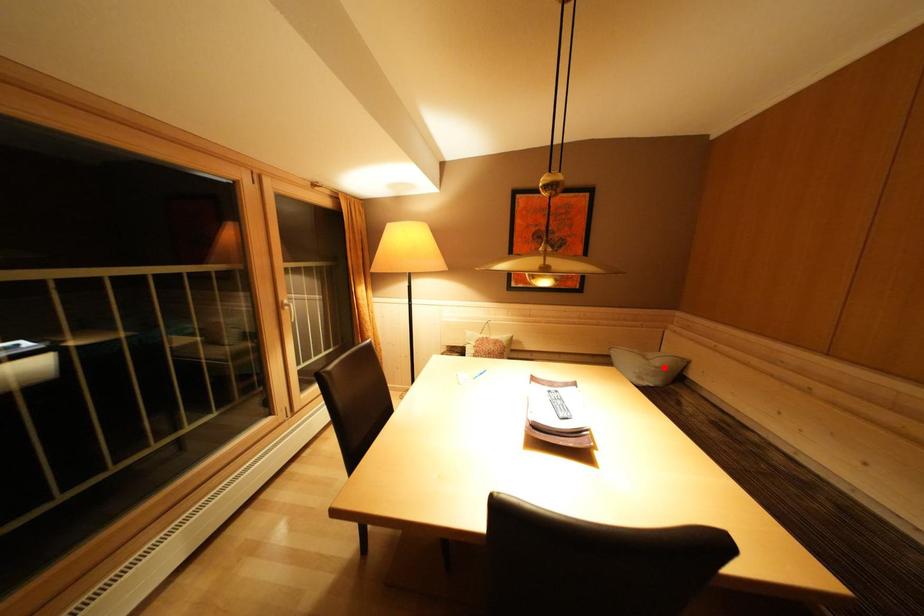
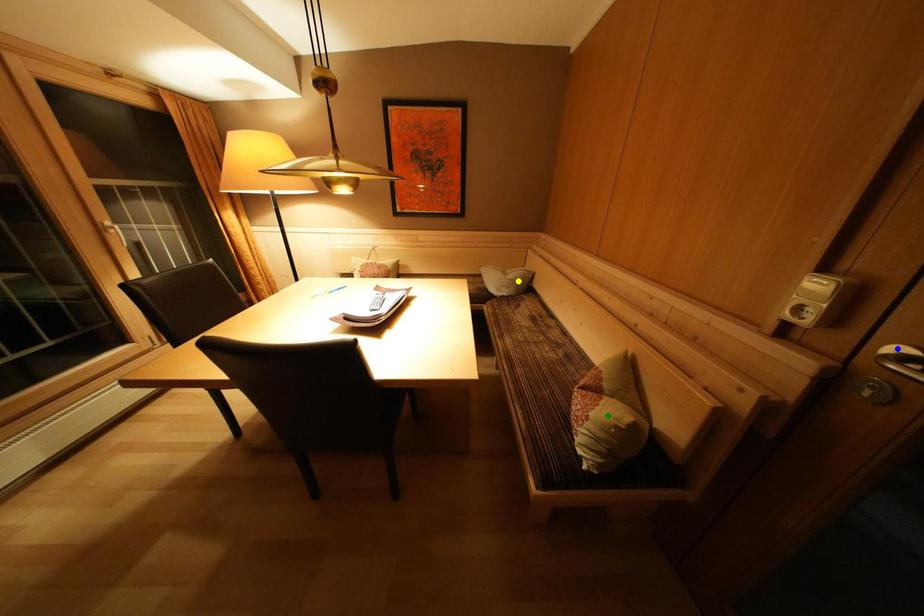
Question: I am providing you with two images of the same scene from different viewpoints. A red point is marked on the first image. You are given multiple points on the second image. Which spot in image 2 lines up with the point in image 1?

Choices:
 (A) green point
 (B) yellow point
 (C) blue point

Answer: (B)